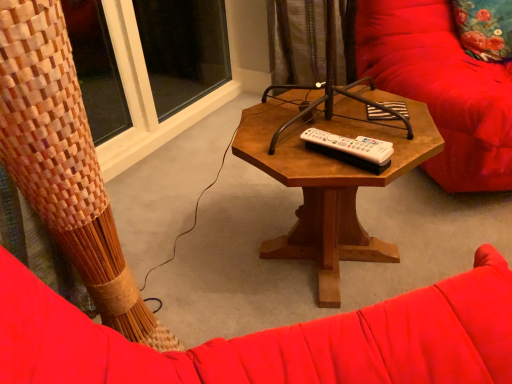
Question: Is velvet red swivel chair at right wider or thinner than white plastic remote at center?

Choices:
 (A) wide
 (B) thin

Answer: (A)

Question: Choose the correct answer: Is velvet red swivel chair at right inside white plastic remote at center or outside it?

Choices:
 (A) inside
 (B) outside

Answer: (B)

Question: Which object is positioned farthest from the white plastic remote at center?

Choices:
 (A) woven wood curtain at upper left
 (B) transparent glass window at upper left
 (C) velvet red swivel chair at right
 (D) floral fabric pillow at upper right
 (E) woodenobject at center

Answer: (B)

Question: Estimate the real-world distances between objects in this image. Which object is closer to the floral fabric pillow at upper right?

Choices:
 (A) woven wood curtain at upper left
 (B) velvet red swivel chair at right
 (C) white plastic remote at center
 (D) woodenobject at center
 (E) transparent glass window at upper left

Answer: (B)